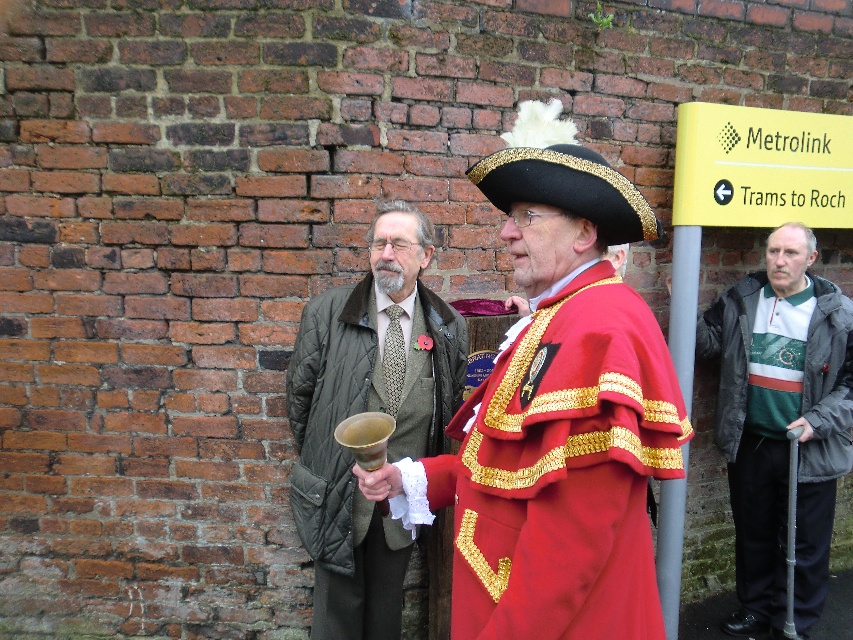
Question: Is shiny gold bell at center to the right of green and white sweater at right from the viewer's perspective?

Choices:
 (A) no
 (B) yes

Answer: (A)

Question: Which of these objects is positioned closest to the quilted fabric coat at center?

Choices:
 (A) green and white sweater at right
 (B) shiny gold bell at center

Answer: (B)

Question: Among these objects, which one is farthest from the camera?

Choices:
 (A) green and white sweater at right
 (B) quilted fabric coat at center
 (C) shiny gold bell at center

Answer: (A)

Question: Is shiny gold bell at center further to camera compared to green and white sweater at right?

Choices:
 (A) yes
 (B) no

Answer: (B)

Question: Among these points, which one is nearest to the camera?

Choices:
 (A) (827, 476)
 (B) (465, 340)
 (C) (648, 422)

Answer: (C)

Question: Can you confirm if shiny gold bell at center is thinner than quilted fabric coat at center?

Choices:
 (A) no
 (B) yes

Answer: (A)